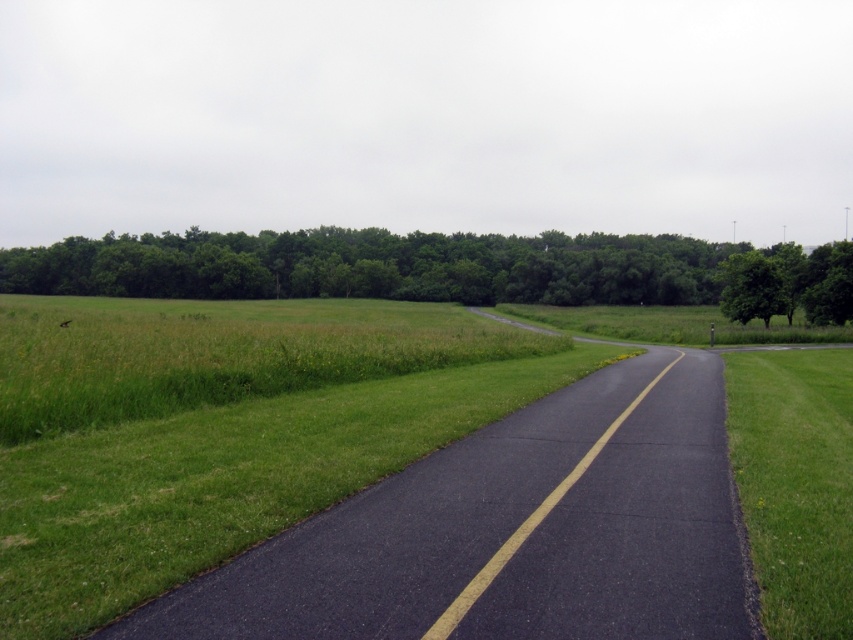
Question: Which is nearer to the green leafy tree at right?

Choices:
 (A) green grass at right
 (B) green grass at center

Answer: (B)

Question: Is green grass at center further to the viewer compared to green leafy tree at center?

Choices:
 (A) yes
 (B) no

Answer: (B)

Question: Is green grass at center to the left of green leafy tree at center from the viewer's perspective?

Choices:
 (A) no
 (B) yes

Answer: (B)

Question: Which point is closer to the camera?

Choices:
 (A) (746, 368)
 (B) (769, 259)
 (C) (27, 426)
 (D) (321, 241)

Answer: (C)

Question: Can you confirm if green grass at center is positioned to the right of green leafy tree at right?

Choices:
 (A) no
 (B) yes

Answer: (A)

Question: Estimate the real-world distances between objects in this image. Which object is closer to the green leafy tree at right?

Choices:
 (A) green grass at right
 (B) green leafy tree at center
 (C) green grass at center

Answer: (C)